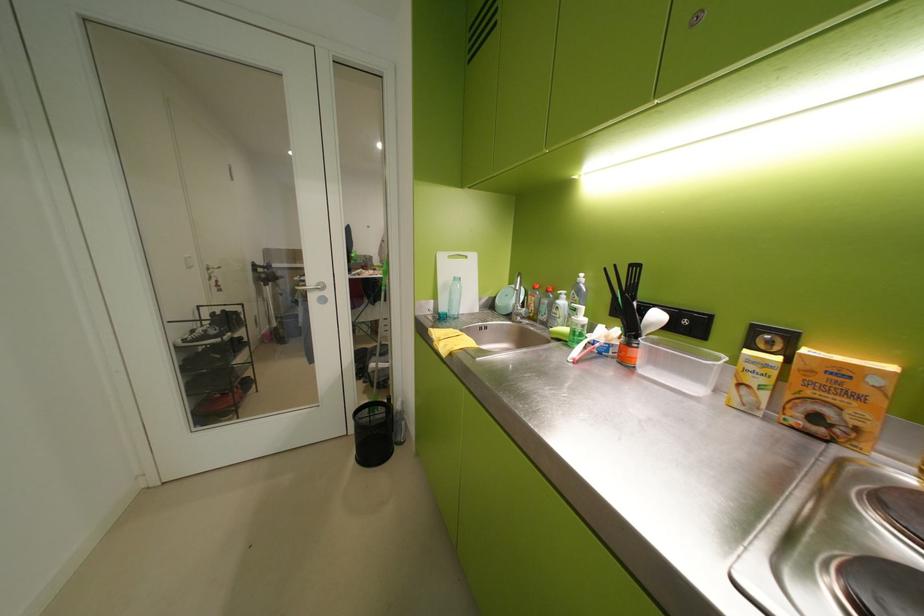
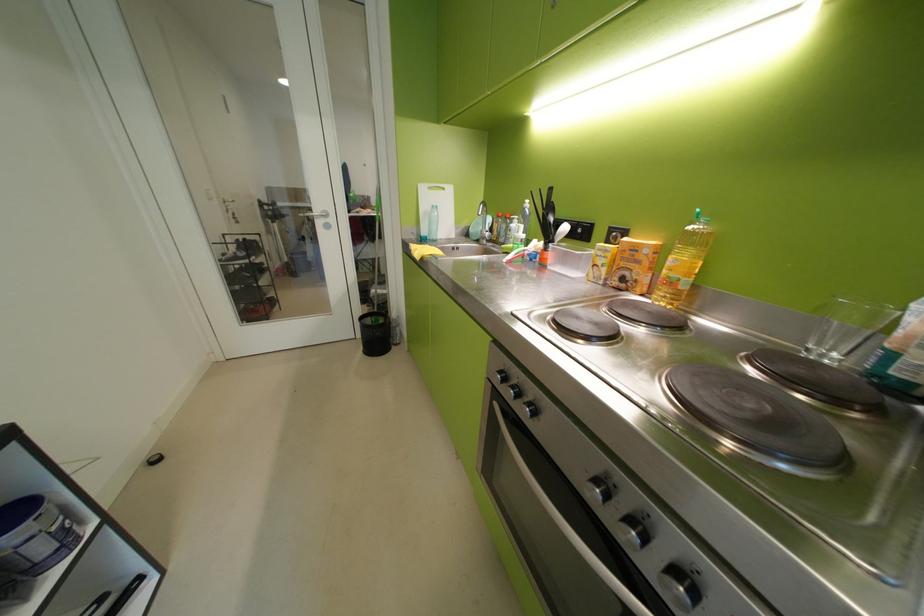
In the second image, find the point that corresponds to point (453, 259) in the first image.

(433, 190)